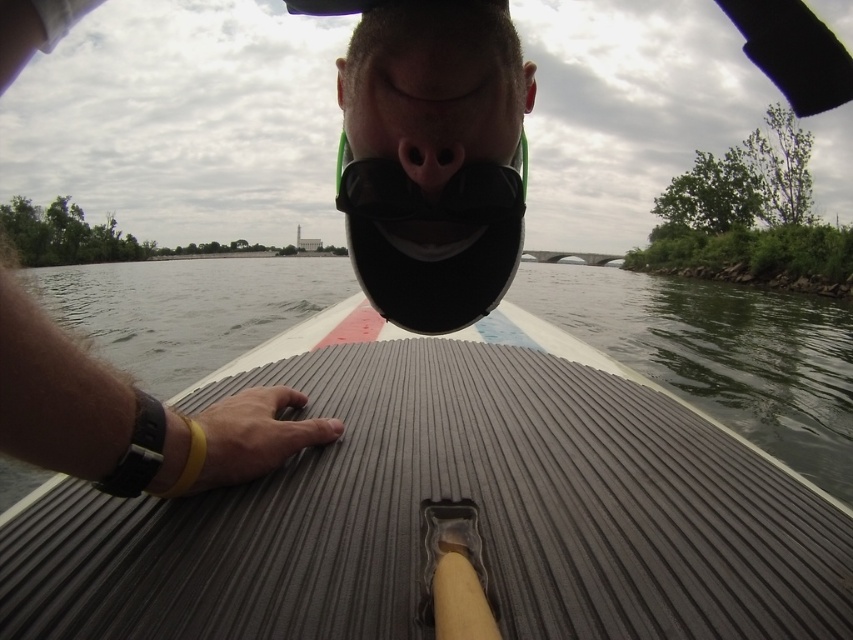
Does gray ribbed paddleboard at center come in front of matte black mouth at center?

Yes, it is.

Does point (358, 554) lie behind point (448, 77)?

No, (358, 554) is in front of (448, 77).

Describe the element at coordinates (447, 497) in the screenshot. This screenshot has width=853, height=640. I see `gray ribbed paddleboard at center` at that location.

Image resolution: width=853 pixels, height=640 pixels. Identify the location of gray ribbed paddleboard at center. (447, 497).

Between gray ribbed paddleboard at center and matte black nose at center, which one is positioned higher?

Positioned higher is matte black nose at center.

Describe the element at coordinates (447, 497) in the screenshot. I see `gray ribbed paddleboard at center` at that location.

Who is more distant from viewer, (578, 397) or (410, 172)?

Positioned behind is point (578, 397).

Locate an element on the screen. The height and width of the screenshot is (640, 853). gray ribbed paddleboard at center is located at coordinates (447, 497).

Does matte black mouth at center have a larger size compared to matte black nose at center?

Yes.

Does matte black mouth at center have a greater width compared to matte black nose at center?

Yes.

Is point (432, 96) farther from camera compared to point (409, 140)?

No, (432, 96) is in front of (409, 140).

You are a GUI agent. You are given a task and a screenshot of the screen. Output one action in this format:
    pyautogui.click(x=<x>, y=<y>)
    Task: Click on the matte black mouth at center
    The image size is (853, 640).
    Given the screenshot: What is the action you would take?
    pyautogui.click(x=430, y=86)